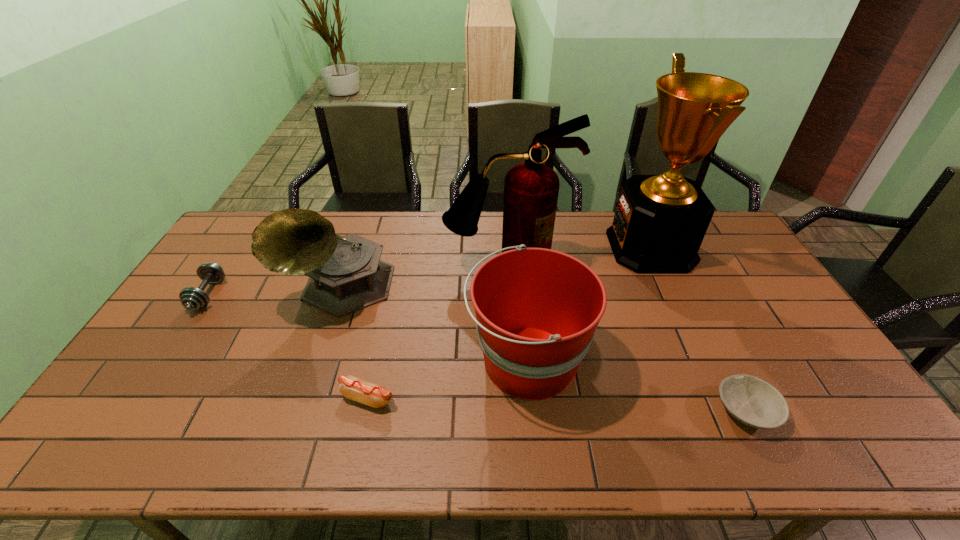
I want to click on trophy cup, so click(660, 221).

What are the coordinates of `fire extinguisher` in the screenshot? It's located at (531, 189).

At what (x,y) coordinates should I click in order to perform the action: click on phonograph record. Please return your answer as a coordinate pair (x, y). Looking at the image, I should click on (345, 273).

Locate an element on the screen. Image resolution: width=960 pixels, height=540 pixels. bucket is located at coordinates (537, 309).

Where is `the leftmost object`? the leftmost object is located at coordinates pos(192,298).

Find the location of `dumbbell`. dumbbell is located at coordinates (192, 298).

Locate an element on the screen. the second shortest object is located at coordinates (352, 387).

This screenshot has height=540, width=960. Find the location of `bowl`. bowl is located at coordinates (754, 402).

Locate an element on the screen. free point located 0.200m on the front of the trophy cup with the label is located at coordinates (555, 247).

Locate an element on the screen. The width and height of the screenshot is (960, 540). free spot located 0.400m on the front of the trophy cup with the label is located at coordinates (499, 247).